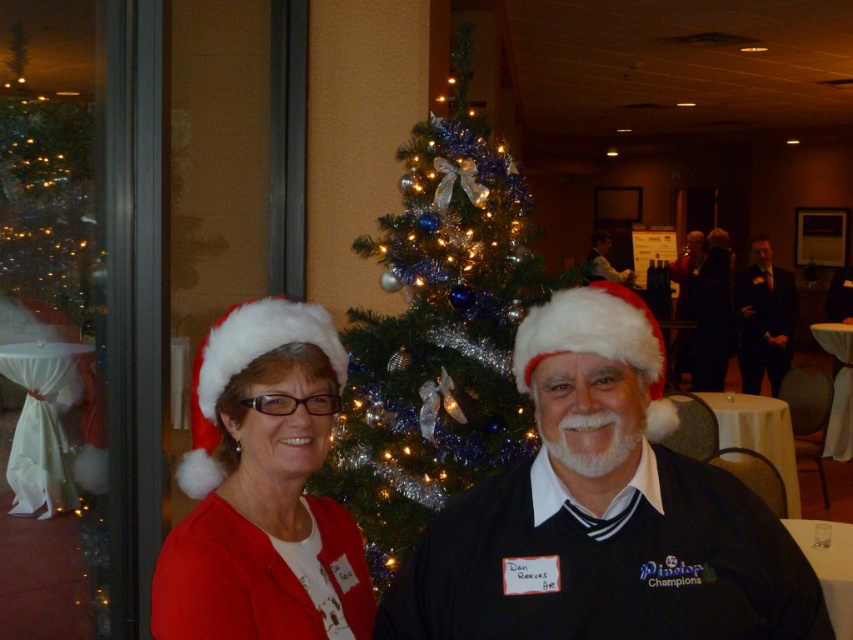
Which is below, white fluffy santa hat at left or matte black suit at right?

Positioned lower is white fluffy santa hat at left.

Which is behind, point (207, 362) or point (770, 340)?

The point (770, 340) is behind.

Which is behind, point (212, 449) or point (775, 360)?

Point (775, 360)

Image resolution: width=853 pixels, height=640 pixels. I want to click on white fluffy santa hat at left, so click(244, 369).

Is white santa hat at center shorter than matte black santa hat at center?

Yes.

In the scene shown: Does white santa hat at center come in front of matte black santa hat at center?

Yes, it is in front of matte black santa hat at center.

Between point (744, 486) and point (695, 266), which one is positioned behind?

Positioned behind is point (695, 266).

Where is `white santa hat at center`? white santa hat at center is located at coordinates (602, 513).

Who is higher up, matte black suit at right or dark suit at center?

dark suit at center is above.

Looking at this image, can you confirm if matte black suit at right is positioned to the left of dark suit at center?

Indeed, matte black suit at right is positioned on the left side of dark suit at center.

Is point (776, 268) in front of point (798, 308)?

No, (776, 268) is further to viewer.

Where is `matte black suit at right`? Image resolution: width=853 pixels, height=640 pixels. matte black suit at right is located at coordinates (746, 324).